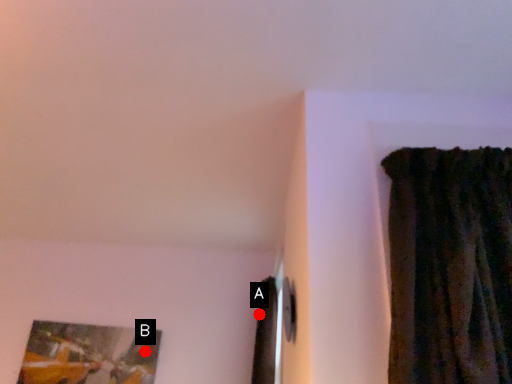
Question: Two points are circled on the image, labeled by A and B beside each circle. Which of the following is the closest to the observer?

Choices:
 (A) A is closer
 (B) B is closer

Answer: (A)